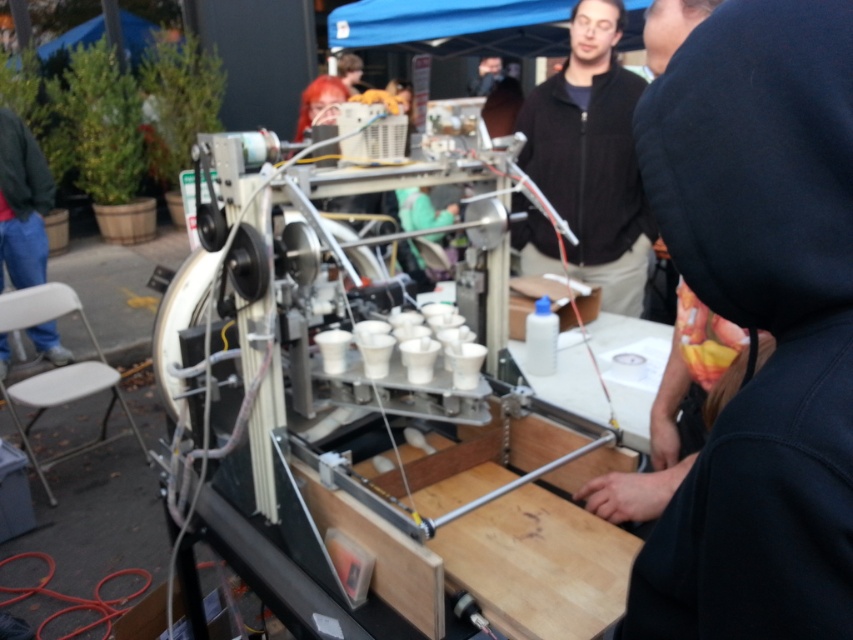
Question: Which of the following is the closest to the observer?

Choices:
 (A) blue jeans at lower left
 (B) white plastic chair at lower left
 (C) black zip-up jacket at upper center

Answer: (C)

Question: Which of the following is the closest to the observer?

Choices:
 (A) (91, 384)
 (B) (608, 205)
 (C) (30, 180)

Answer: (B)

Question: Does black zip-up jacket at upper center appear over white plastic chair at lower left?

Choices:
 (A) yes
 (B) no

Answer: (A)

Question: Estimate the real-world distances between objects in this image. Which object is farther from the blue fabric canopy at upper center?

Choices:
 (A) black zip-up jacket at upper center
 (B) white plastic chair at lower left

Answer: (B)

Question: Is black zip-up jacket at upper center bigger than blue fabric canopy at upper center?

Choices:
 (A) no
 (B) yes

Answer: (A)

Question: Is the position of black zip-up jacket at upper center less distant than that of blue fabric canopy at upper center?

Choices:
 (A) yes
 (B) no

Answer: (A)